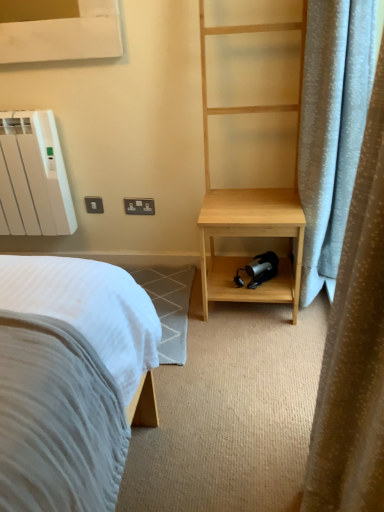
Question: From the image's perspective, is natural wood bookshelf at right above light blue fabric curtain at right?

Choices:
 (A) yes
 (B) no

Answer: (A)

Question: From a real-world perspective, does natural wood bookshelf at right sit lower than light blue fabric curtain at right?

Choices:
 (A) no
 (B) yes

Answer: (A)

Question: Is natural wood bookshelf at right aimed at light blue fabric curtain at right?

Choices:
 (A) no
 (B) yes

Answer: (B)

Question: Is natural wood bookshelf at right bigger than light blue fabric curtain at right?

Choices:
 (A) no
 (B) yes

Answer: (B)

Question: Does natural wood bookshelf at right have a lesser height compared to light blue fabric curtain at right?

Choices:
 (A) no
 (B) yes

Answer: (A)

Question: Is natural wood bookshelf at right facing away from light blue fabric curtain at right?

Choices:
 (A) yes
 (B) no

Answer: (B)

Question: Is natural wood bookshelf at right at the back of light blue fabric curtain at right?

Choices:
 (A) yes
 (B) no

Answer: (B)

Question: Does light blue fabric curtain at right appear on the right side of natural wood bookshelf at right?

Choices:
 (A) yes
 (B) no

Answer: (A)

Question: Considering the relative sizes of light blue fabric curtain at right and natural wood bookshelf at right in the image provided, is light blue fabric curtain at right shorter than natural wood bookshelf at right?

Choices:
 (A) no
 (B) yes

Answer: (B)

Question: Is light blue fabric curtain at right completely or partially outside of natural wood bookshelf at right?

Choices:
 (A) no
 (B) yes

Answer: (B)

Question: Does light blue fabric curtain at right come in front of natural wood bookshelf at right?

Choices:
 (A) yes
 (B) no

Answer: (A)

Question: Considering the relative sizes of light blue fabric curtain at right and natural wood bookshelf at right in the image provided, is light blue fabric curtain at right wider than natural wood bookshelf at right?

Choices:
 (A) yes
 (B) no

Answer: (B)

Question: Would you say white matte radiator at upper left contains light blue fabric curtain at right?

Choices:
 (A) yes
 (B) no

Answer: (B)